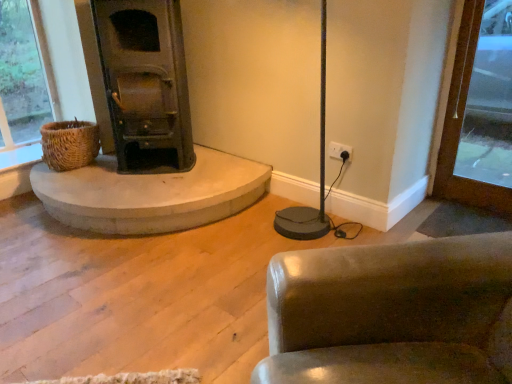
At what (x,y) coordinates should I click in order to perform the action: click on dark green metal wood burning stove at left. Please return your answer as a coordinate pair (x, y). Looking at the image, I should click on (145, 84).

I want to click on brown wood door at right, so click(x=461, y=125).

At what (x,y) coordinates should I click in order to perform the action: click on dark green metal wood burning stove at left. Please return your answer as a coordinate pair (x, y). Looking at the image, I should click on (145, 84).

From the image's perspective, is woven brown basket at left located above leather-like brown chair at lower right?

Correct, woven brown basket at left appears higher than leather-like brown chair at lower right in the image.

Is woven brown basket at left directly adjacent to leather-like brown chair at lower right?

No, woven brown basket at left is not beside leather-like brown chair at lower right.

Could you tell me if woven brown basket at left is turned towards leather-like brown chair at lower right?

Yes.

Is dark green metal wood burning stove at left looking in the opposite direction of woven brown basket at left?

No, dark green metal wood burning stove at left's orientation is not away from woven brown basket at left.

Can you see dark green metal wood burning stove at left touching woven brown basket at left?

dark green metal wood burning stove at left is not next to woven brown basket at left, and they're not touching.

Can you tell me how much dark green metal wood burning stove at left and woven brown basket at left differ in facing direction?

The facing directions of dark green metal wood burning stove at left and woven brown basket at left are 4.2 degrees apart.

Which of these two, dark green metal wood burning stove at left or woven brown basket at left, is smaller?

With smaller size is woven brown basket at left.

From the image's perspective, would you say brown wood door at right is shown under dark green metal wood burning stove at left?

Yes.

Can you confirm if brown wood door at right is smaller than dark green metal wood burning stove at left?

Yes, brown wood door at right is smaller than dark green metal wood burning stove at left.

From their relative heights in the image, would you say brown wood door at right is taller or shorter than dark green metal wood burning stove at left?

brown wood door at right is taller than dark green metal wood burning stove at left.

From a real-world perspective, who is located lower, leather-like brown chair at lower right or dark green metal wood burning stove at left?

In real-world perspective, leather-like brown chair at lower right is lower.

Between leather-like brown chair at lower right and dark green metal wood burning stove at left, which one appears on the right side from the viewer's perspective?

From the viewer's perspective, leather-like brown chair at lower right appears more on the right side.

Between leather-like brown chair at lower right and dark green metal wood burning stove at left, which one has larger width?

leather-like brown chair at lower right is wider.

Are leather-like brown chair at lower right and dark green metal wood burning stove at left located far from each other?

Yes, leather-like brown chair at lower right and dark green metal wood burning stove at left are quite far apart.

From the image's perspective, is brown wood door at right above or below leather-like brown chair at lower right?

From the image's perspective, brown wood door at right appears above leather-like brown chair at lower right.

From a real-world perspective, which object stands above the other?

brown wood door at right is physically above.

Consider the image. Is brown wood door at right oriented towards leather-like brown chair at lower right?

Yes.

In the scene shown: Is dark green metal wood burning stove at left to the left or to the right of leather-like brown chair at lower right in the image?

From the image, it's evident that dark green metal wood burning stove at left is to the left of leather-like brown chair at lower right.

Considering the relative sizes of dark green metal wood burning stove at left and leather-like brown chair at lower right in the image provided, is dark green metal wood burning stove at left bigger than leather-like brown chair at lower right?

No.

Is leather-like brown chair at lower right surrounded by dark green metal wood burning stove at left?

No.

Between dark green metal wood burning stove at left and leather-like brown chair at lower right, which one has less height?

Standing shorter between the two is leather-like brown chair at lower right.

From the image's perspective, is dark green metal wood burning stove at left located beneath brown wood door at right?

No, from the image's perspective, dark green metal wood burning stove at left is not below brown wood door at right.

Between dark green metal wood burning stove at left and brown wood door at right, which one has larger size?

dark green metal wood burning stove at left.

You are a GUI agent. You are given a task and a screenshot of the screen. Output one action in this format:
    pyautogui.click(x=<x>, y=<y>)
    Task: Click on the wood burning stove above the brown wood door at right (from the image's perspective)
    The height and width of the screenshot is (384, 512).
    Given the screenshot: What is the action you would take?
    pyautogui.click(x=145, y=84)

Is dark green metal wood burning stove at left located outside brown wood door at right?

Yes, dark green metal wood burning stove at left is located beyond the bounds of brown wood door at right.

Identify the location of chair positioned vertically above the woven brown basket at left (from a real-world perspective). The height and width of the screenshot is (384, 512). (391, 313).

The image size is (512, 384). In order to click on wood burning stove in front of the woven brown basket at left in this screenshot , I will do `click(145, 84)`.

Which object lies further to the anchor point dark green metal wood burning stove at left, leather-like brown chair at lower right or brown wood door at right?

leather-like brown chair at lower right is further to dark green metal wood burning stove at left.

Which object lies nearer to the anchor point leather-like brown chair at lower right, woven brown basket at left or dark green metal wood burning stove at left?

The object closer to leather-like brown chair at lower right is dark green metal wood burning stove at left.

Estimate the real-world distances between objects in this image. Which object is closer to woven brown basket at left, brown wood door at right or leather-like brown chair at lower right?

leather-like brown chair at lower right lies closer to woven brown basket at left than the other object.

From the image, which object appears to be nearer to dark green metal wood burning stove at left, brown wood door at right or woven brown basket at left?

woven brown basket at left is closer to dark green metal wood burning stove at left.

From the image, which object appears to be farther from leather-like brown chair at lower right, woven brown basket at left or brown wood door at right?

The object further to leather-like brown chair at lower right is woven brown basket at left.

When comparing their distances from woven brown basket at left, does dark green metal wood burning stove at left or leather-like brown chair at lower right seem closer?

dark green metal wood burning stove at left lies closer to woven brown basket at left than the other object.

Based on their spatial positions, is leather-like brown chair at lower right or woven brown basket at left further from dark green metal wood burning stove at left?

leather-like brown chair at lower right.

When comparing their distances from leather-like brown chair at lower right, does dark green metal wood burning stove at left or woven brown basket at left seem further?

woven brown basket at left is further to leather-like brown chair at lower right.

Where is `chair between dark green metal wood burning stove at left and brown wood door at right`? The image size is (512, 384). chair between dark green metal wood burning stove at left and brown wood door at right is located at coordinates (391, 313).

Find the location of a particular element. The height and width of the screenshot is (384, 512). wood burning stove positioned between leather-like brown chair at lower right and woven brown basket at left from near to far is located at coordinates (145, 84).

I want to click on chair located between woven brown basket at left and brown wood door at right in the left-right direction, so click(x=391, y=313).

The image size is (512, 384). Identify the location of wood burning stove between woven brown basket at left and brown wood door at right in the horizontal direction. (145, 84).